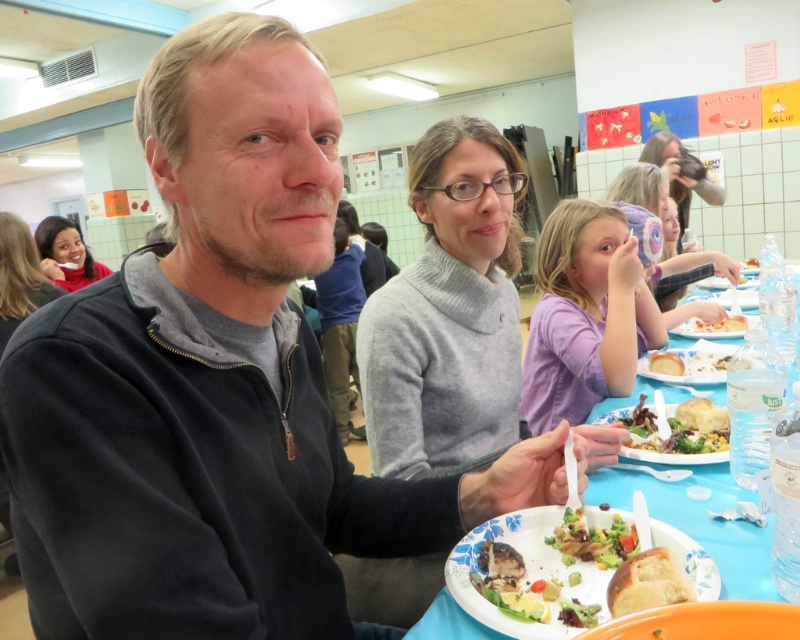
You are a guest at the event and want to place your napkin between the brown matte bread at lower center and the matte red sweater at upper left. Which object should you place the napkin to the left of?

The brown matte bread at lower center is positioned on the right side of the matte red sweater at upper left. Therefore, you should place the napkin to the left of the brown matte bread at lower center so that it is between the two objects.

You are a chef preparing to place a decorative centerpiece on the table between the brown matte bread at lower center and the matte red sweater at upper left. Considering their heights, which object should the centerpiece be placed closer to?

The brown matte bread at lower center has a lesser height compared to the matte red sweater at upper left, so the centerpiece should be placed closer to the brown matte bread at lower center to ensure visual balance.